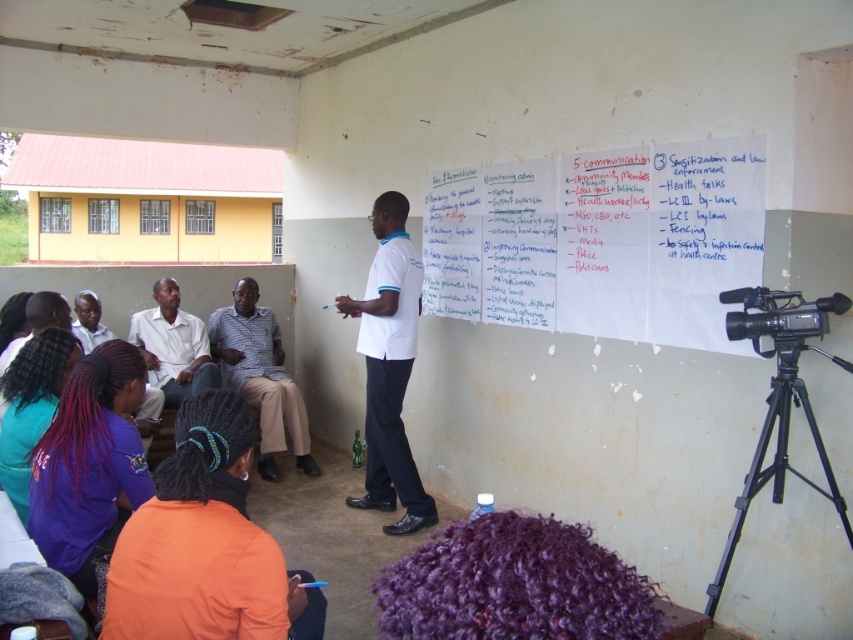
Question: Can you confirm if checkered fabric shirt at center is wider than black plastic video camera at lower right?

Choices:
 (A) no
 (B) yes

Answer: (B)

Question: Considering the relative positions of teal fabric hair at lower left and black plastic video camera at lower right in the image provided, where is teal fabric hair at lower left located with respect to black plastic video camera at lower right?

Choices:
 (A) right
 (B) left

Answer: (B)

Question: Which point is farther to the camera?

Choices:
 (A) black plastic video camera at lower right
 (B) black metal tripod at lower right
 (C) matte white shirt at upper left

Answer: (C)

Question: Is black metal tripod at lower right above black plastic video camera at lower right?

Choices:
 (A) no
 (B) yes

Answer: (A)

Question: Estimate the real-world distances between objects in this image. Which object is farther from the white smooth shirt at center?

Choices:
 (A) black plastic video camera at lower right
 (B) matte white shirt at upper left
 (C) purple fabric hair at lower left
 (D) white shirt at center

Answer: (A)

Question: Among these points, which one is nearest to the camera?

Choices:
 (A) (747, 241)
 (B) (131, 442)
 (C) (223, 356)
 (D) (790, 339)

Answer: (B)